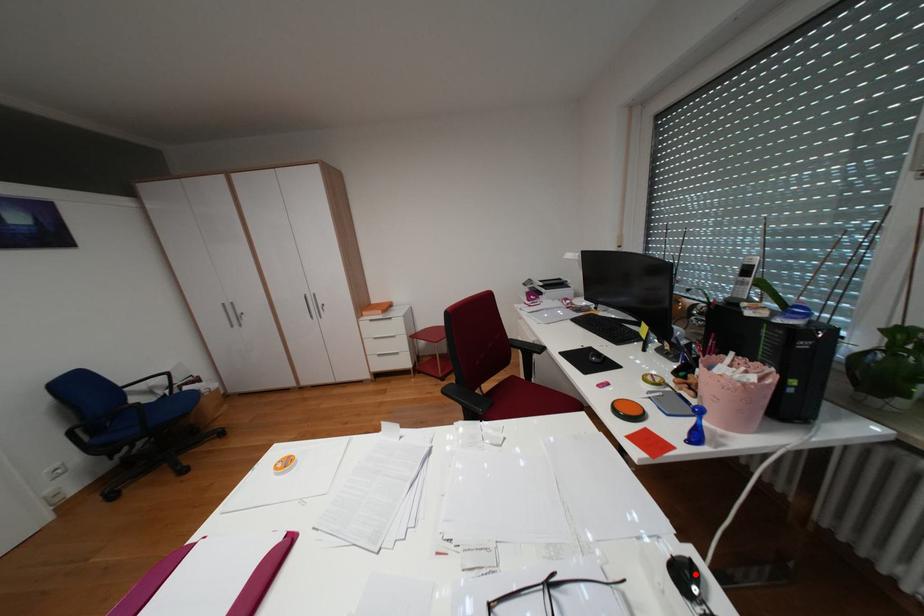
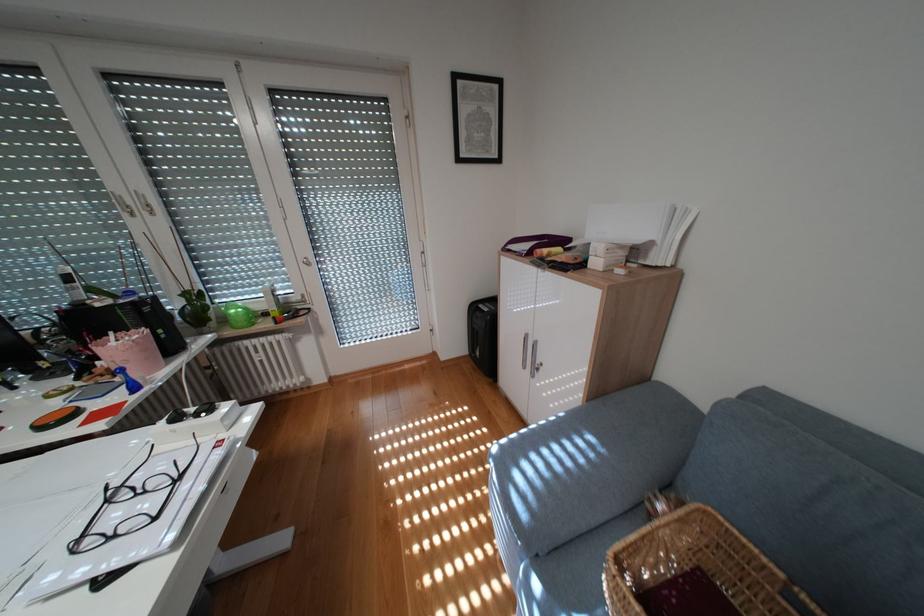
Find the pixel in the second image that matches the highlighted location in the first image.

(188, 418)